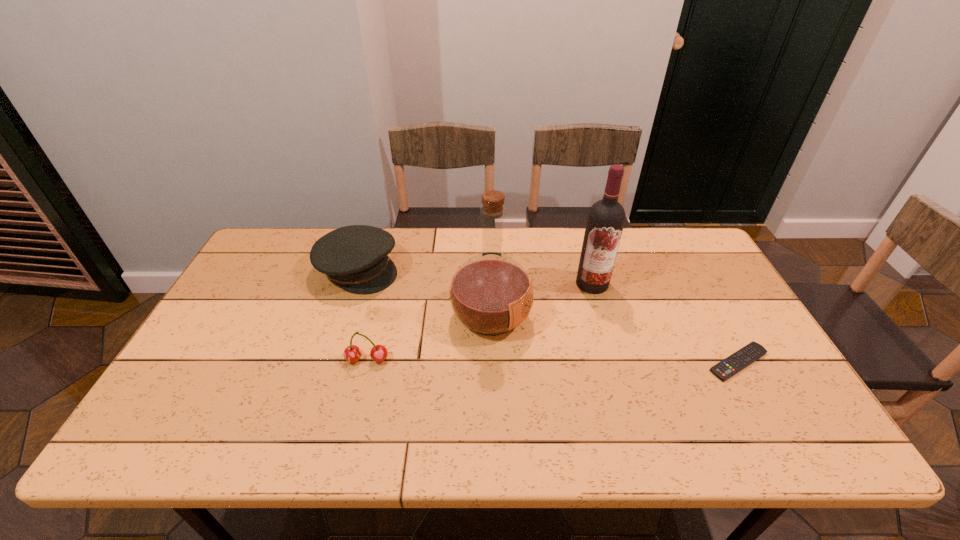
The height and width of the screenshot is (540, 960). What are the coordinates of `free space on the desktop that is between the cherry and the rightmost object and is positioned on the label of the wine bottle` in the screenshot? It's located at (565, 361).

The height and width of the screenshot is (540, 960). Find the location of `free space on the desktop that is between the cherry and the remote control and is positioned on the front-facing side of the beret`. free space on the desktop that is between the cherry and the remote control and is positioned on the front-facing side of the beret is located at coordinates click(x=516, y=361).

At what (x,y) coordinates should I click in order to perform the action: click on free space on the desktop that is between the cherry and the remote control and is positioned on the front label of the liquor. Please return your answer as a coordinate pair (x, y). Looking at the image, I should click on (598, 361).